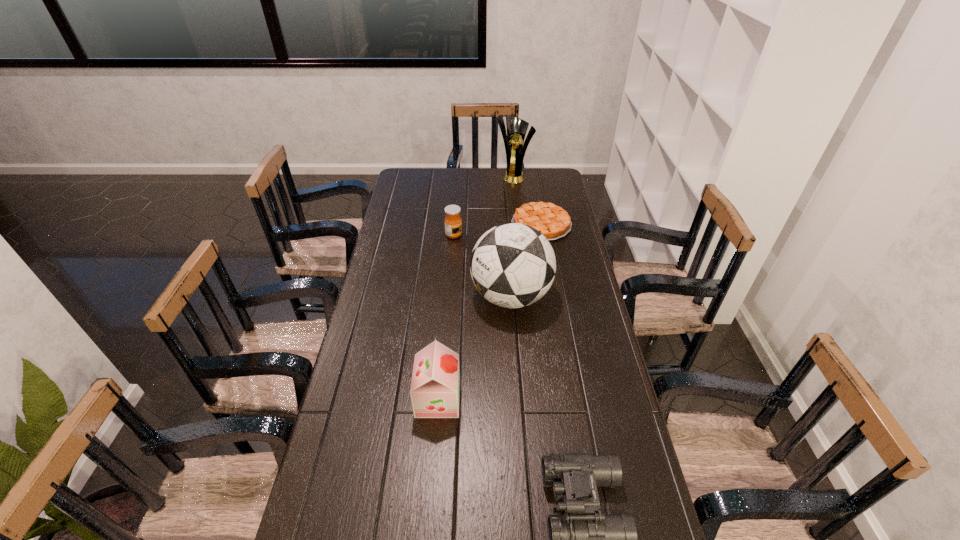
This screenshot has height=540, width=960. I want to click on free region at the right edge, so click(604, 401).

Identify the location of free location at the far right corner of the desktop. (540, 182).

Locate an element on the screen. The image size is (960, 540). free area in between the soccer ball and the fourth shortest object is located at coordinates (474, 347).

Locate an element on the screen. The height and width of the screenshot is (540, 960). vacant area that lies between the award and the shortest object is located at coordinates (527, 200).

Identify the location of unoccupied area between the honey and the fourth shortest object. This screenshot has height=540, width=960. (446, 317).

At what (x,y) coordinates should I click in order to perform the action: click on empty space that is in between the honey and the award. Please return your answer as a coordinate pair (x, y). This screenshot has width=960, height=540. Looking at the image, I should click on (484, 206).

The image size is (960, 540). Find the location of `free space that is in between the third tallest object and the soccer ball`. free space that is in between the third tallest object and the soccer ball is located at coordinates (474, 347).

Locate which object ranks fifth in proximity to the binoculars. Please provide its 2D coordinates. Your answer should be formatted as a tuple, i.e. [(x, y)], where the tuple contains the x and y coordinates of a point satisfying the conditions above.

[(513, 140)]

Identify the location of object that is the third closest to the nearest object. (553, 222).

Locate an element on the screen. blank space that satisfies the following two spatial constraints: 1. on the front side of the shortest object; 2. with the cap open on the soya milk is located at coordinates (572, 399).